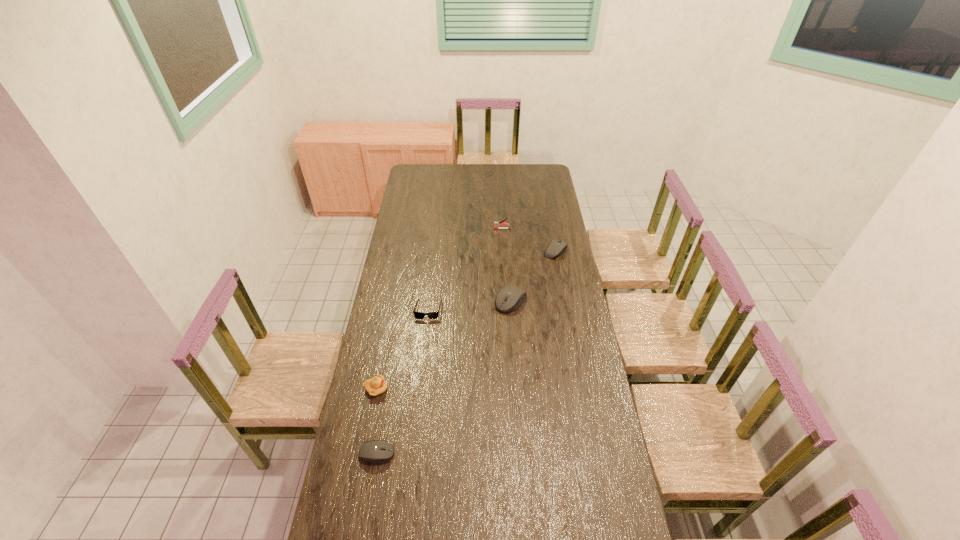
Where is `vacant space situated on the front of the rightmost object`? The width and height of the screenshot is (960, 540). vacant space situated on the front of the rightmost object is located at coordinates (559, 267).

At what (x,y) coordinates should I click in order to perform the action: click on vacant region located on the front-facing side of the fourth object from right to left. Please return your answer as a coordinate pair (x, y). Looking at the image, I should click on (426, 333).

Identify the location of free space located 0.080m on the handle side of the farthest object. (479, 229).

Where is `vacant space situated 0.070m on the handle side of the farthest object`? vacant space situated 0.070m on the handle side of the farthest object is located at coordinates (481, 229).

Find the location of a particular element. This screenshot has height=540, width=960. vacant space located 0.390m on the handle side of the farthest object is located at coordinates (423, 229).

Identify the location of vacant space located 0.350m on the front-facing side of the duckling. (478, 388).

You are a GUI agent. You are given a task and a screenshot of the screen. Output one action in this format:
    pyautogui.click(x=<x>, y=<y>)
    Task: Click on the computer equipment that is at the left edge
    The width and height of the screenshot is (960, 540).
    Given the screenshot: What is the action you would take?
    pyautogui.click(x=376, y=451)

Where is `duckling present at the left edge`? The image size is (960, 540). duckling present at the left edge is located at coordinates click(377, 385).

Where is `object that is at the right edge`? object that is at the right edge is located at coordinates (556, 248).

Where is `vacant space at the far edge of the desktop`? vacant space at the far edge of the desktop is located at coordinates (451, 176).